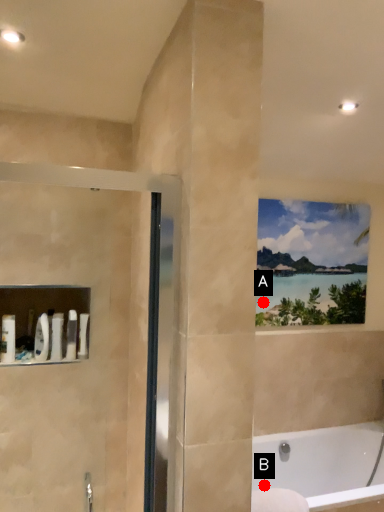
Question: Two points are circled on the image, labeled by A and B beside each circle. Which point is farther from the camera taking this photo?

Choices:
 (A) A is further
 (B) B is further

Answer: (A)